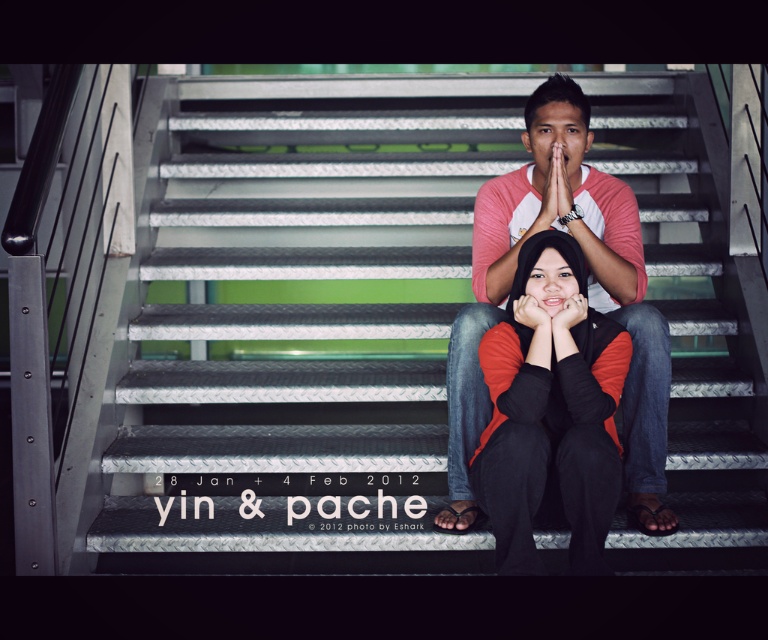
You are an interior designer planning to install a new lighting fixture above the metallic stairwell at center and the matte pink shirt at center. Based on their heights, which object should the lighting fixture be placed higher above?

The metallic stairwell at center is much taller than the matte pink shirt at center, so the lighting fixture should be placed higher above the metallic stairwell at center to accommodate its height.

You are trying to decide whether to place a large potted plant on the metallic stairwell at center. Considering the size of the matte orange sweater at center already there, will the plant fit on the stairwell?

The metallic stairwell at center is bigger than the matte orange sweater at center, so the plant should fit as long as it is not larger than the sweater.

You are standing at the bottom of the metallic stairwell at center and want to reach the person wearing the matte orange sweater at center. Which direction should you move to get closer to them?

The metallic stairwell at center is located above the matte orange sweater at center, so you should move downward along the metallic stairwell at center to reach the person wearing the matte orange sweater at center.